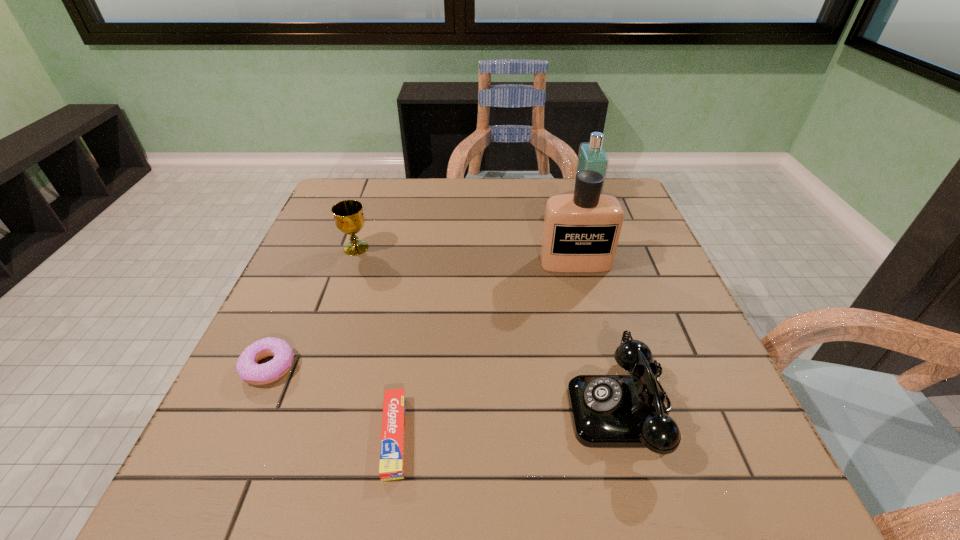
Locate an element on the screen. This screenshot has width=960, height=540. telephone that is at the near edge is located at coordinates (608, 411).

Image resolution: width=960 pixels, height=540 pixels. I want to click on toothpaste positioned at the near edge, so click(x=391, y=467).

Where is `chalice at the left edge`? This screenshot has height=540, width=960. chalice at the left edge is located at coordinates (348, 214).

The height and width of the screenshot is (540, 960). What are the coordinates of `doughnut at the left edge` in the screenshot? It's located at (247, 366).

What are the coordinates of `telephone that is at the right edge` in the screenshot? It's located at pos(608,411).

Locate an element on the screen. Image resolution: width=960 pixels, height=540 pixels. object that is at the far right corner is located at coordinates (592, 156).

Find the location of `object that is positioned at the near right corner`. object that is positioned at the near right corner is located at coordinates (608, 411).

In the image, there is a desktop. Identify the location of free space at the far edge. tap(383, 209).

Where is `blank area at the near edge`? blank area at the near edge is located at coordinates (466, 485).

I want to click on free space at the left edge of the desktop, so click(x=363, y=227).